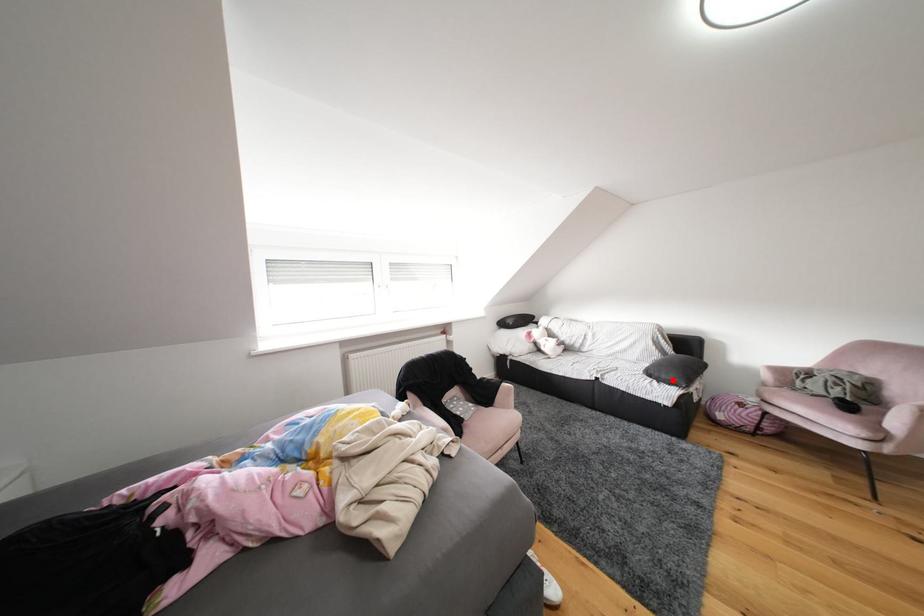
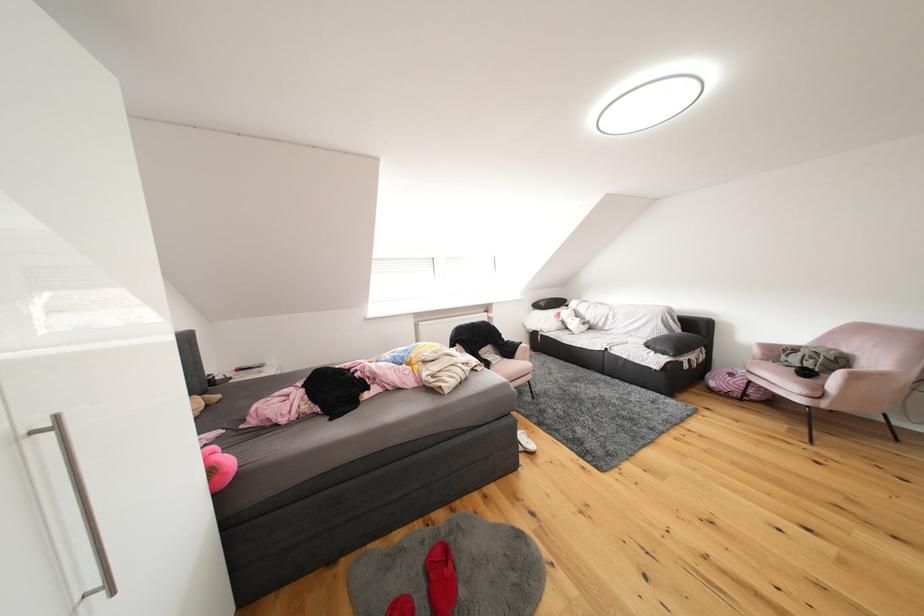
In the second image, find the point that corresponds to the highlighted location in the first image.

(667, 351)